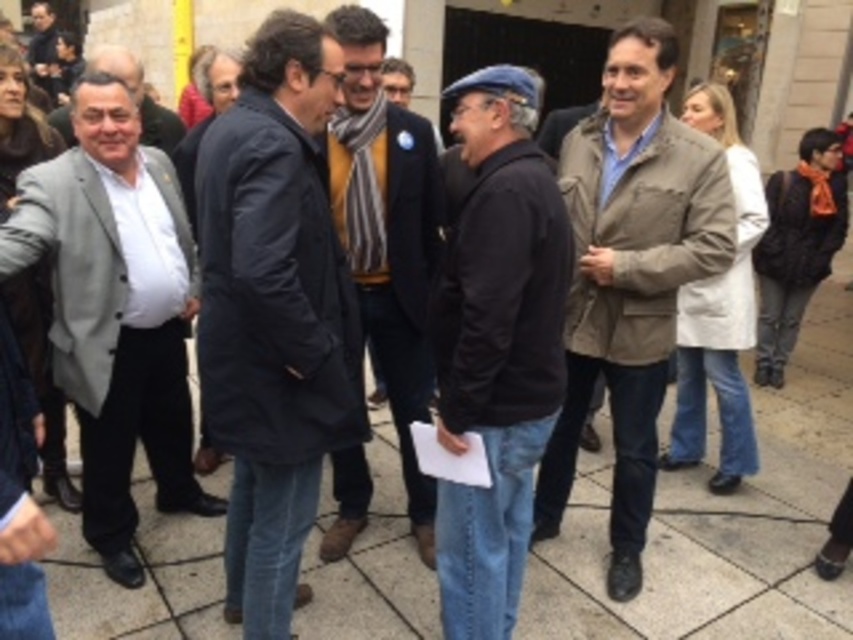
You are standing at the origin point of the coordinate system in the image. The point marked at coordinate (630, 275) is labeled as tan leather jacket at center. If you walk straight ahead, will you reach the tan leather jacket at center before reaching the building facade in the background?

The point (630, 275) corresponds to the tan leather jacket at center, which is in the foreground. Since the building facade is in the background, walking straight ahead would reach the tan leather jacket at center before the building facade.

You are standing at the origin point of the coordinate system in the image. Where is the dark blue sweater at center located in terms of coordinates?

The dark blue sweater at center is located at coordinates point (497, 346).